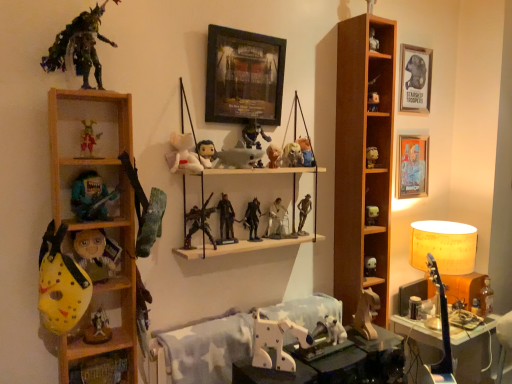
Question: Is yellow foam hockey mask at left, the sixth toy in the bottom-to-top sequence, taller than wooden dog at center, which is counted as the 24th toy, starting from the top?

Choices:
 (A) no
 (B) yes

Answer: (B)

Question: From the image's perspective, is yellow foam hockey mask at left, the sixth toy in the bottom-to-top sequence, located above wooden dog at center, the 1th toy ordered from the bottom?

Choices:
 (A) yes
 (B) no

Answer: (A)

Question: Does yellow foam hockey mask at left, the nineteenth toy viewed from the top, appear on the left side of wooden dog at center, which is counted as the 24th toy, starting from the top?

Choices:
 (A) yes
 (B) no

Answer: (A)

Question: Does yellow foam hockey mask at left, the sixth toy in the bottom-to-top sequence, have a greater width compared to wooden dog at center, the 1th toy ordered from the bottom?

Choices:
 (A) yes
 (B) no

Answer: (A)

Question: Is yellow foam hockey mask at left, the nineteenth toy viewed from the top, turned away from wooden dog at center, the 1th toy ordered from the bottom?

Choices:
 (A) no
 (B) yes

Answer: (A)

Question: Does yellow foam hockey mask at left, the nineteenth toy viewed from the top, come in front of wooden dog at center, which is counted as the 24th toy, starting from the top?

Choices:
 (A) no
 (B) yes

Answer: (B)

Question: Does matte black action figure at center, the fourth toy from the bottom, come behind matte plastic skull at center, the 5th toy viewed from the top?

Choices:
 (A) no
 (B) yes

Answer: (A)

Question: Is matte black action figure at center, which is the 21th toy in top-to-bottom order, taller than matte plastic skull at center, the 5th toy viewed from the top?

Choices:
 (A) yes
 (B) no

Answer: (B)

Question: Would you say matte plastic skull at center, which is counted as the 20th toy, starting from the bottom, is part of matte black action figure at center, the fourth toy from the bottom,'s contents?

Choices:
 (A) no
 (B) yes

Answer: (A)

Question: Is matte black action figure at center, which is the 21th toy in top-to-bottom order, smaller than matte plastic skull at center, the 5th toy viewed from the top?

Choices:
 (A) no
 (B) yes

Answer: (B)

Question: Does matte black action figure at center, which is the 21th toy in top-to-bottom order, have a larger size compared to matte plastic skull at center, which is counted as the 20th toy, starting from the bottom?

Choices:
 (A) yes
 (B) no

Answer: (B)

Question: Does matte black action figure at center, which is the 21th toy in top-to-bottom order, have a lesser height compared to matte plastic skull at center, which is counted as the 20th toy, starting from the bottom?

Choices:
 (A) yes
 (B) no

Answer: (A)

Question: Is white plastic walker at center, which ranks as the eleventh toy in bottom-to-top order, in front of matte plastic skull at center, the 5th toy viewed from the top?

Choices:
 (A) no
 (B) yes

Answer: (A)